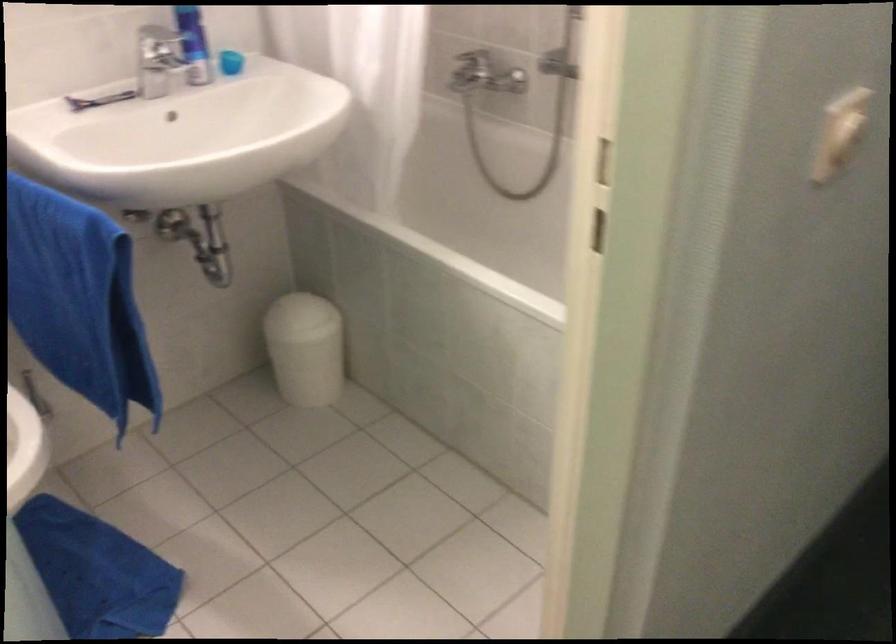
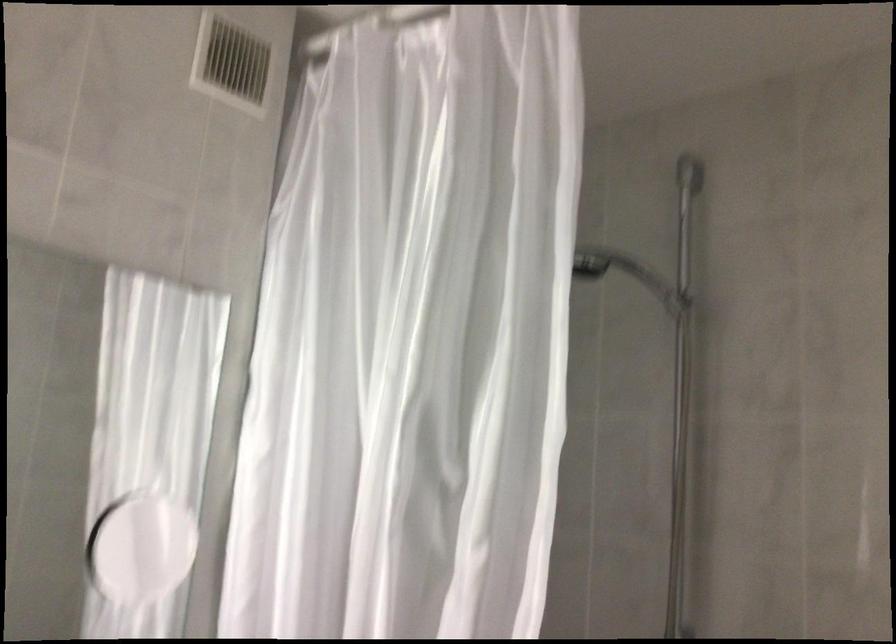
Question: The first image is from the beginning of the video and the second image is from the end. How did the camera likely rotate when shooting the video?

Choices:
 (A) Left
 (B) Right
 (C) Up
 (D) Down

Answer: (C)